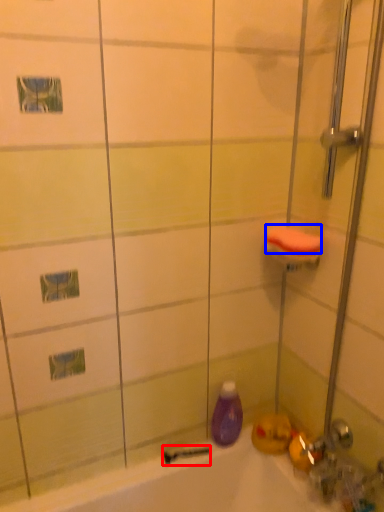
Question: Which object is further to the camera taking this photo, shower (highlighted by a red box) or soap (highlighted by a blue box)?

Choices:
 (A) shower
 (B) soap

Answer: (A)